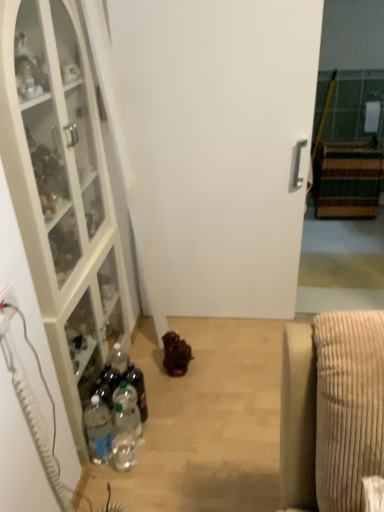
Find the location of a particular element. The width and height of the screenshot is (384, 512). vacant area that is in front of clear plastic bottle at center, the 3th bottle in the left-to-right sequence is located at coordinates (159, 442).